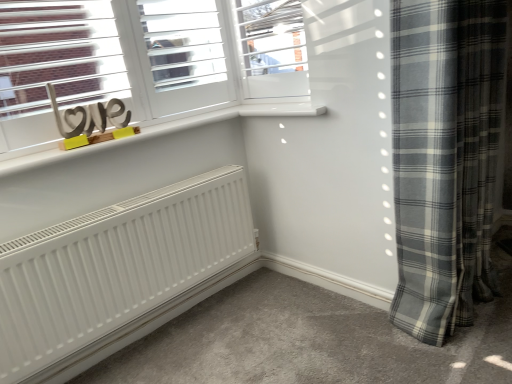
Question: Is wooden love sign at upper left outside gray plaid curtain at right?

Choices:
 (A) no
 (B) yes

Answer: (B)

Question: Is gray plaid curtain at right inside wooden love sign at upper left?

Choices:
 (A) no
 (B) yes

Answer: (A)

Question: Considering the relative sizes of wooden love sign at upper left and gray plaid curtain at right in the image provided, is wooden love sign at upper left shorter than gray plaid curtain at right?

Choices:
 (A) yes
 (B) no

Answer: (A)

Question: Could you tell me if wooden love sign at upper left is facing gray plaid curtain at right?

Choices:
 (A) no
 (B) yes

Answer: (A)

Question: Is wooden love sign at upper left behind gray plaid curtain at right?

Choices:
 (A) no
 (B) yes

Answer: (B)

Question: From a real-world perspective, is wooden love sign at upper left positioned above or below gray plaid curtain at right?

Choices:
 (A) above
 (B) below

Answer: (A)

Question: From the image's perspective, is wooden love sign at upper left positioned above or below gray plaid curtain at right?

Choices:
 (A) below
 (B) above

Answer: (B)

Question: From their relative heights in the image, would you say wooden love sign at upper left is taller or shorter than gray plaid curtain at right?

Choices:
 (A) short
 (B) tall

Answer: (A)

Question: Is wooden love sign at upper left inside the boundaries of gray plaid curtain at right, or outside?

Choices:
 (A) inside
 (B) outside

Answer: (B)

Question: Is point (462, 321) closer or farther from the camera than point (70, 127)?

Choices:
 (A) farther
 (B) closer

Answer: (B)

Question: Considering the positions of gray plaid curtain at right and wooden love sign at upper left in the image, is gray plaid curtain at right bigger or smaller than wooden love sign at upper left?

Choices:
 (A) small
 (B) big

Answer: (B)

Question: Looking at their shapes, would you say gray plaid curtain at right is wider or thinner than wooden love sign at upper left?

Choices:
 (A) wide
 (B) thin

Answer: (A)

Question: Relative to wooden love sign at upper left, is gray plaid curtain at right in front or behind?

Choices:
 (A) behind
 (B) front

Answer: (B)

Question: In terms of width, does white frosted glass window at upper center look wider or thinner when compared to gray plaid curtain at right?

Choices:
 (A) thin
 (B) wide

Answer: (A)

Question: Do you think white frosted glass window at upper center is within gray plaid curtain at right, or outside of it?

Choices:
 (A) outside
 (B) inside

Answer: (A)